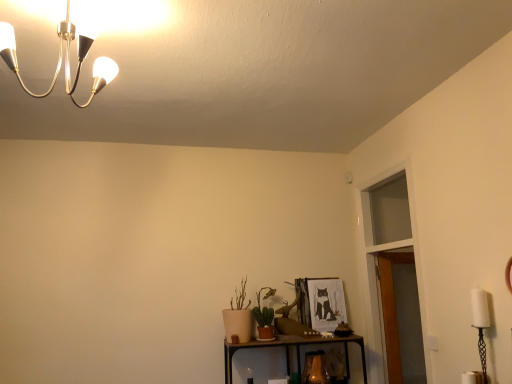
What are the coordinates of `transparent glass door at upper right` in the screenshot? It's located at (390, 246).

In order to face transparent glass door at upper right, should I rotate leftwards or rightwards?

To align with it, rotate right about 18.232°.

The image size is (512, 384). What do you see at coordinates (390, 246) in the screenshot? I see `transparent glass door at upper right` at bounding box center [390, 246].

What do you see at coordinates (264, 309) in the screenshot?
I see `green matte cactus at center` at bounding box center [264, 309].

Measure the distance between green matte cactus at center and camera.

10.37 feet.

What are the coordinates of `green matte cactus at center` in the screenshot? It's located at click(264, 309).

Identify the location of transparent glass door at upper right. This screenshot has width=512, height=384. (390, 246).

Consider the image. Is transparent glass door at upper right to the left of green matte cactus at center from the viewer's perspective?

No, transparent glass door at upper right is not to the left of green matte cactus at center.

Looking at this image, relative to green matte cactus at center, is transparent glass door at upper right in front or behind?

Clearly, transparent glass door at upper right is in front of green matte cactus at center.

Considering the positions of point (419, 306) and point (259, 322), is point (419, 306) closer or farther from the camera than point (259, 322)?

Clearly, point (419, 306) is more distant from the camera than point (259, 322).

From the image's perspective, is transparent glass door at upper right above or below green matte cactus at center?

transparent glass door at upper right is above green matte cactus at center.

From a real-world perspective, is transparent glass door at upper right beneath green matte cactus at center?

No.

Consider the image. Which of these two, transparent glass door at upper right or green matte cactus at center, is wider?

green matte cactus at center is wider.

Who is taller, transparent glass door at upper right or green matte cactus at center?

transparent glass door at upper right.

Can you confirm if transparent glass door at upper right is smaller than green matte cactus at center?

Incorrect, transparent glass door at upper right is not smaller in size than green matte cactus at center.

Is transparent glass door at upper right located outside green matte cactus at center?

transparent glass door at upper right lies outside green matte cactus at center's area.

Are transparent glass door at upper right and green matte cactus at center far apart?

transparent glass door at upper right is far away from green matte cactus at center.

Is transparent glass door at upper right oriented towards green matte cactus at center?

Yes.

How many degrees apart are the facing directions of transparent glass door at upper right and green matte cactus at center?

There is a 89.4-degree angle between the facing directions of transparent glass door at upper right and green matte cactus at center.

Measure the distance between transparent glass door at upper right and green matte cactus at center.

3.56 feet.

The image size is (512, 384). In order to click on plant below the transparent glass door at upper right (from a real-world perspective) in this screenshot , I will do `click(264, 309)`.

Looking at this image, is green matte cactus at center to the right of transparent glass door at upper right from the viewer's perspective?

Incorrect, green matte cactus at center is not on the right side of transparent glass door at upper right.

Does green matte cactus at center lie behind transparent glass door at upper right?

Yes, green matte cactus at center is behind transparent glass door at upper right.

Which is farther from the camera, [269,314] or [420,289]?

Positioned behind is point [269,314].

From the image's perspective, between green matte cactus at center and transparent glass door at upper right, which one is located above?

transparent glass door at upper right appears higher in the image.

From a real-world perspective, which object rests below the other?

green matte cactus at center, from a real-world perspective.

Can you confirm if green matte cactus at center is thinner than transparent glass door at upper right?

In fact, green matte cactus at center might be wider than transparent glass door at upper right.

Does green matte cactus at center have a greater height compared to transparent glass door at upper right?

In fact, green matte cactus at center may be shorter than transparent glass door at upper right.

Between green matte cactus at center and transparent glass door at upper right, which one has larger size?

transparent glass door at upper right.

Choose the correct answer: Is green matte cactus at center inside transparent glass door at upper right or outside it?

green matte cactus at center is outside transparent glass door at upper right.

Is green matte cactus at center in contact with transparent glass door at upper right?

No, green matte cactus at center is not with transparent glass door at upper right.

Is green matte cactus at center positioned with its back to transparent glass door at upper right?

No, transparent glass door at upper right is not at the back of green matte cactus at center.

This screenshot has width=512, height=384. In order to click on plant that is below the transparent glass door at upper right (from the image's perspective) in this screenshot , I will do `click(264, 309)`.

This screenshot has height=384, width=512. In order to click on glass door above the green matte cactus at center (from a real-world perspective) in this screenshot , I will do `click(390, 246)`.

At what (x,y) coordinates should I click in order to perform the action: click on plant lying behind the transparent glass door at upper right. Please return your answer as a coordinate pair (x, y). The image size is (512, 384). Looking at the image, I should click on pyautogui.click(x=264, y=309).